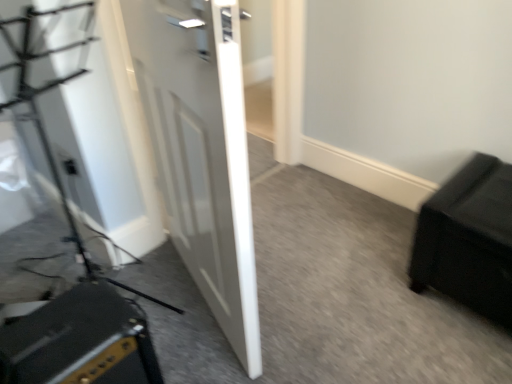
Question: Can you confirm if matte black outlet at lower left is shorter than white glossy door at center?

Choices:
 (A) no
 (B) yes

Answer: (B)

Question: Is white glossy door at center completely or partially inside matte black outlet at lower left?

Choices:
 (A) yes
 (B) no

Answer: (B)

Question: Does matte black outlet at lower left appear on the left side of white glossy door at center?

Choices:
 (A) no
 (B) yes

Answer: (B)

Question: From a real-world perspective, is matte black outlet at lower left located higher than white glossy door at center?

Choices:
 (A) yes
 (B) no

Answer: (B)

Question: Is matte black outlet at lower left located outside white glossy door at center?

Choices:
 (A) yes
 (B) no

Answer: (A)

Question: Is matte black outlet at lower left placed right next to white glossy door at center?

Choices:
 (A) no
 (B) yes

Answer: (A)

Question: Does black matte speaker at lower left have a larger size compared to matte black outlet at lower left?

Choices:
 (A) no
 (B) yes

Answer: (B)

Question: Could you tell me if black matte speaker at lower left is turned towards matte black outlet at lower left?

Choices:
 (A) no
 (B) yes

Answer: (A)

Question: Would you say matte black outlet at lower left is part of black matte speaker at lower left's contents?

Choices:
 (A) yes
 (B) no

Answer: (B)

Question: Considering the relative sizes of black matte speaker at lower left and matte black outlet at lower left in the image provided, is black matte speaker at lower left smaller than matte black outlet at lower left?

Choices:
 (A) yes
 (B) no

Answer: (B)

Question: From the image's perspective, is black matte speaker at lower left below matte black outlet at lower left?

Choices:
 (A) yes
 (B) no

Answer: (A)

Question: Considering the relative positions of black matte speaker at lower left and matte black outlet at lower left in the image provided, is black matte speaker at lower left behind matte black outlet at lower left?

Choices:
 (A) no
 (B) yes

Answer: (A)

Question: Is white glossy door at center facing away from black matte speaker at lower left?

Choices:
 (A) yes
 (B) no

Answer: (B)